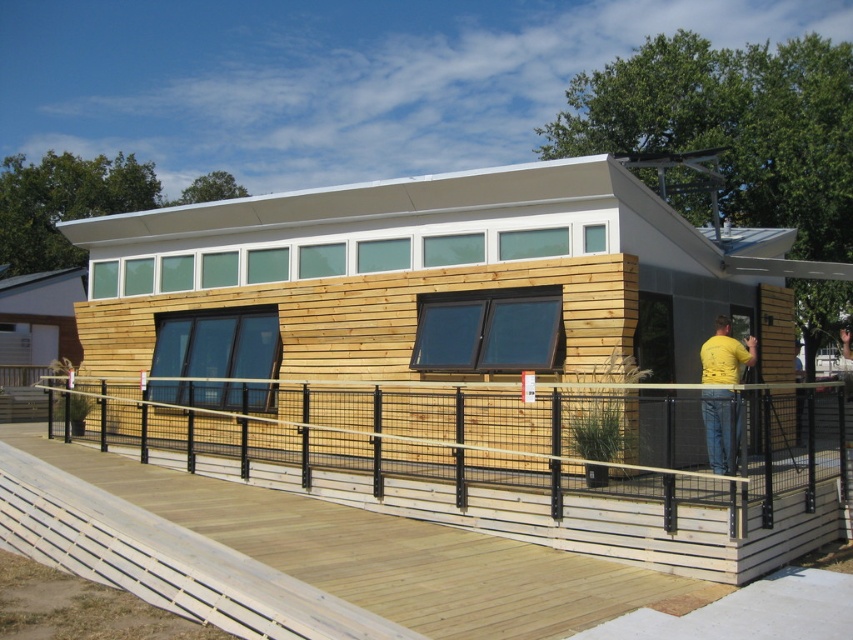
Does wooden slats at lower center have a greater height compared to yellow matte shirt at upper right?

Yes, wooden slats at lower center is taller than yellow matte shirt at upper right.

Who is more distant from viewer, (659, 547) or (723, 321)?

Positioned behind is point (723, 321).

This screenshot has width=853, height=640. I want to click on wooden slats at lower center, so click(496, 465).